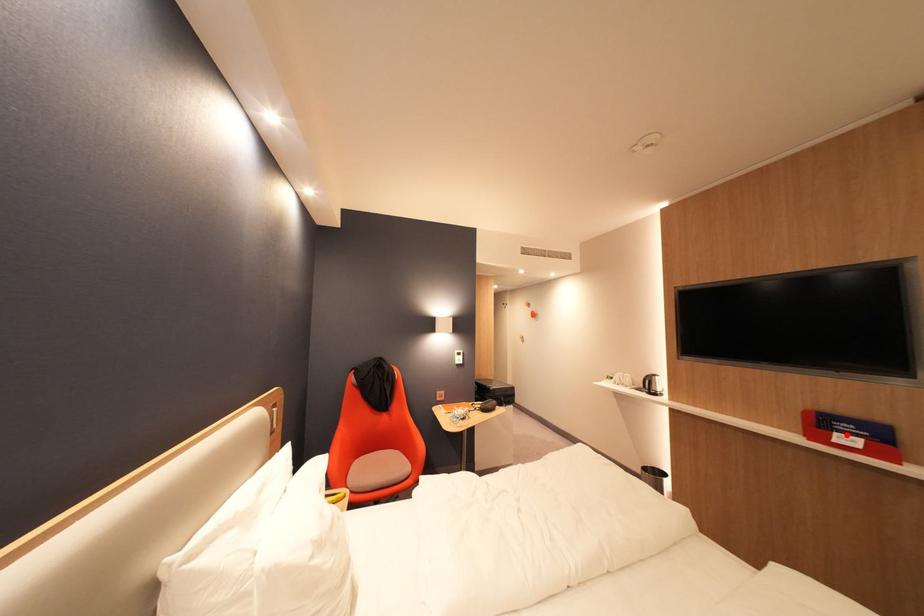
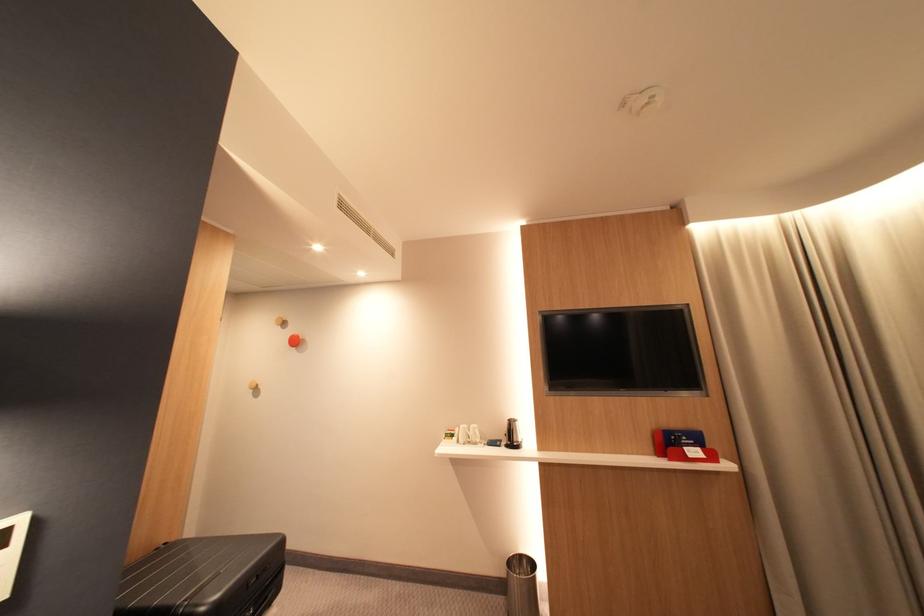
The point at the highlighted location is marked in the first image. Where is the corresponding point in the second image?

(696, 450)